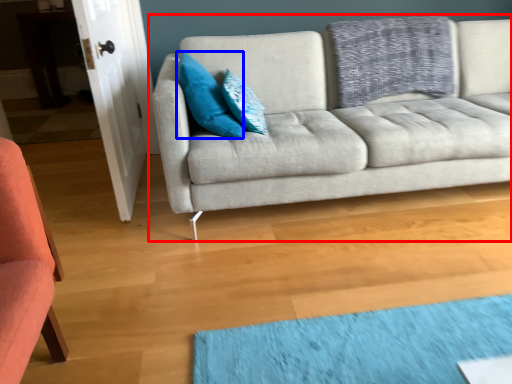
Question: Which object is closer to the camera taking this photo, studio couch (highlighted by a red box) or pillow (highlighted by a blue box)?

Choices:
 (A) studio couch
 (B) pillow

Answer: (A)